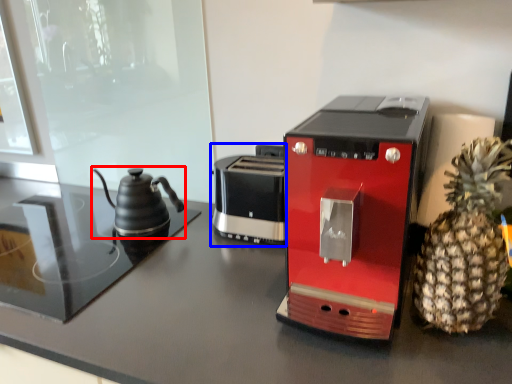
Question: Which object is further to the camera taking this photo, kettle (highlighted by a red box) or toaster (highlighted by a blue box)?

Choices:
 (A) kettle
 (B) toaster

Answer: (A)